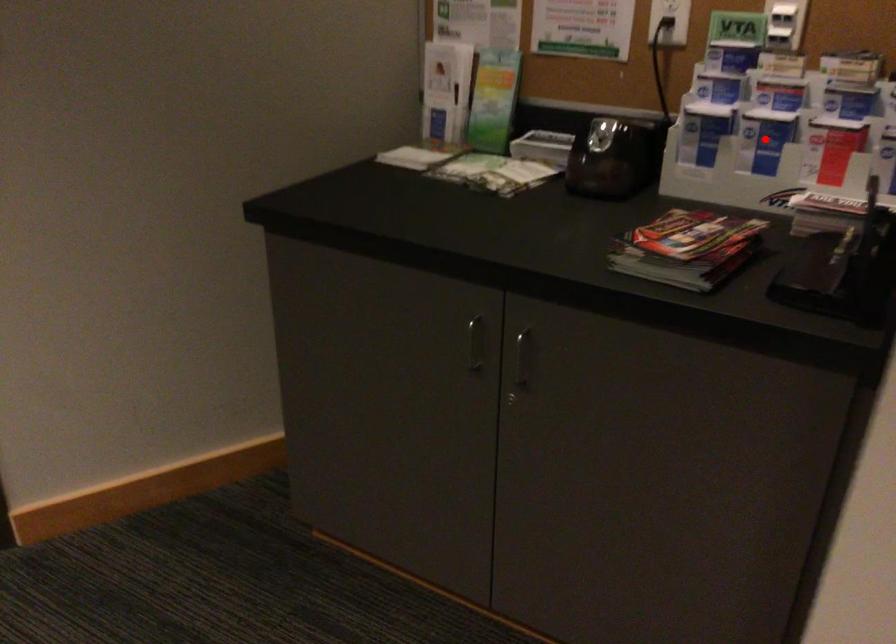
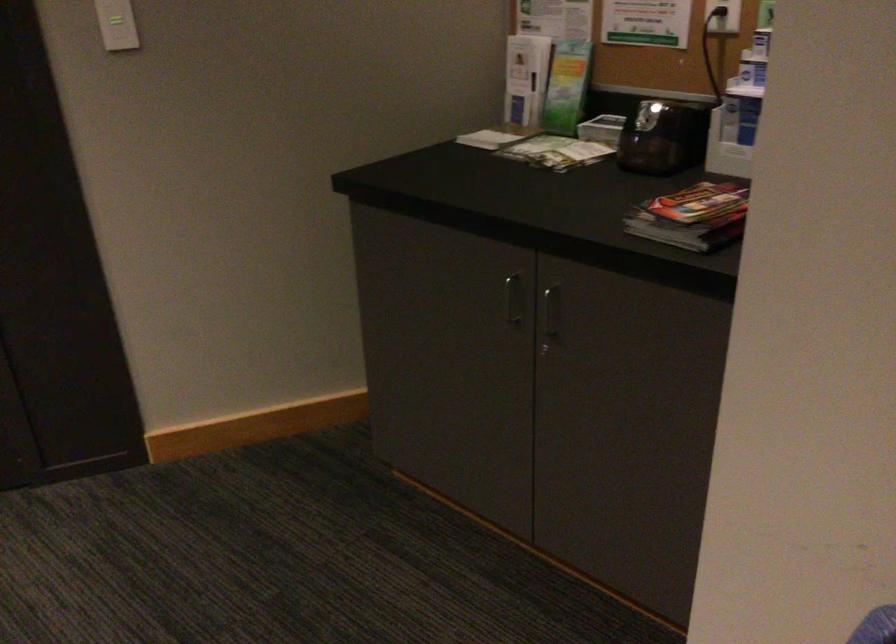
Question: I am providing you with two images of the same scene from different viewpoints. A red point is marked on the first image. At the location where the point appears in image 1, is it still visible in image 2?

Choices:
 (A) Yes
 (B) No

Answer: (B)